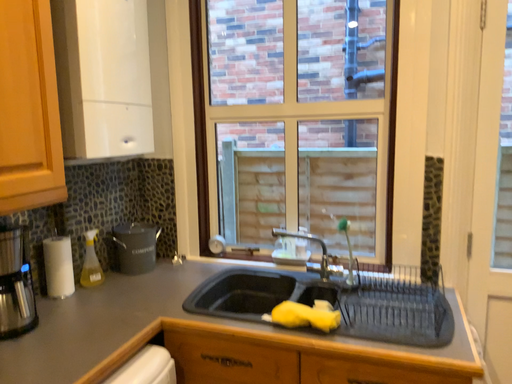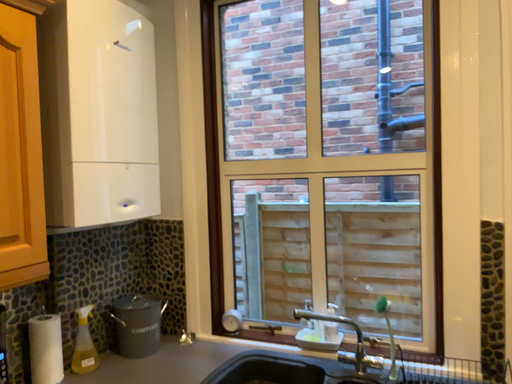
Question: Which way did the camera rotate in the video?

Choices:
 (A) rotated upward
 (B) rotated downward

Answer: (A)